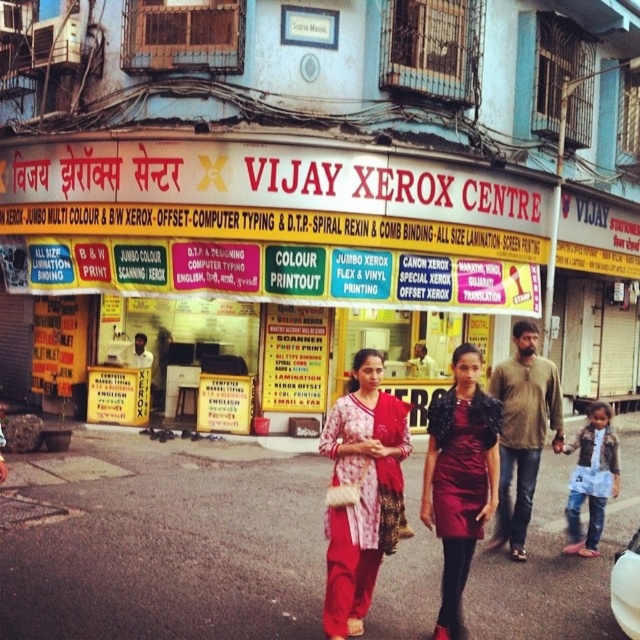
Based on the scene description, where is the yellow painted signboard at center located in terms of coordinates?

The yellow painted signboard at center is located at coordinates point (269, 225).